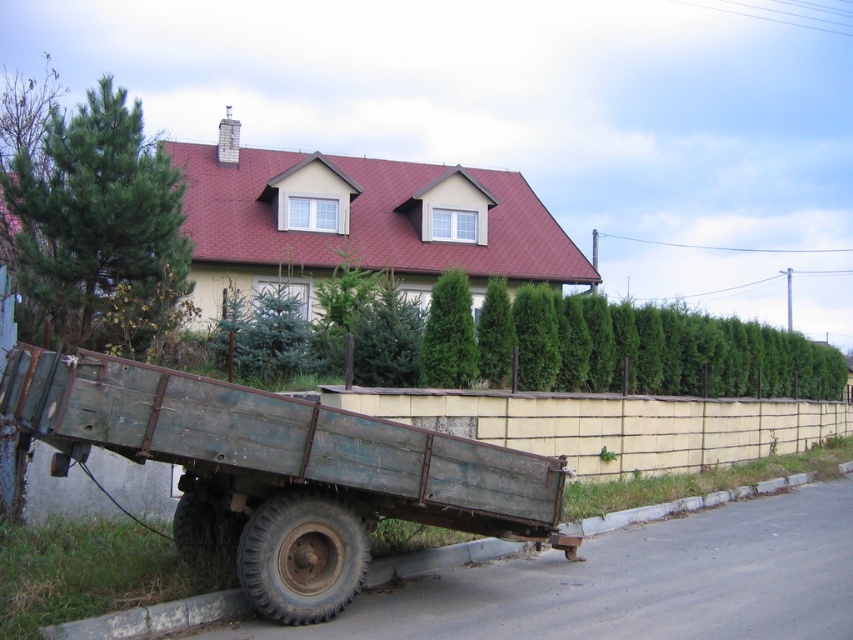
Is green leafy hedge at center taller than gray concrete curb at lower left?

Yes, green leafy hedge at center is taller than gray concrete curb at lower left.

Identify the location of green leafy hedge at center. (553, 342).

Measure the distance from rusty metal wagon at lower left to green leafy hedge at center.

rusty metal wagon at lower left is 23.36 feet from green leafy hedge at center.

Between rusty metal wagon at lower left and green leafy hedge at center, which one is positioned lower?

rusty metal wagon at lower left is below.

Which is behind, point (554, 538) or point (329, 353)?

Positioned behind is point (329, 353).

Locate an element on the screen. The width and height of the screenshot is (853, 640). rusty metal wagon at lower left is located at coordinates (279, 472).

Between point (264, 614) and point (225, 596), which one is positioned behind?

Positioned behind is point (225, 596).

In the scene shown: Which of these two, rusty metal wagon at lower left or gray concrete curb at lower left, stands taller?

With more height is rusty metal wagon at lower left.

Which is in front, point (218, 448) or point (610, 520)?

Positioned in front is point (218, 448).

Where is `rusty metal wagon at lower left`? This screenshot has height=640, width=853. rusty metal wagon at lower left is located at coordinates (279, 472).